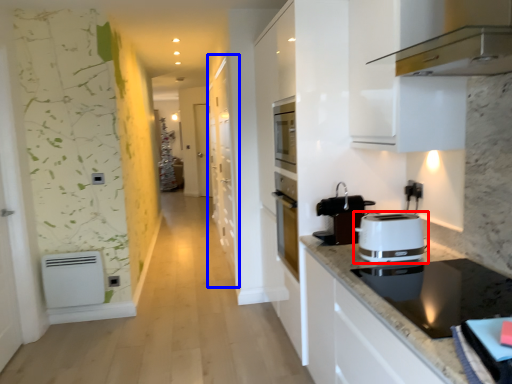
Question: Which point is closer to the camera, toaster (highlighted by a red box) or cabinetry (highlighted by a blue box)?

Choices:
 (A) toaster
 (B) cabinetry

Answer: (A)